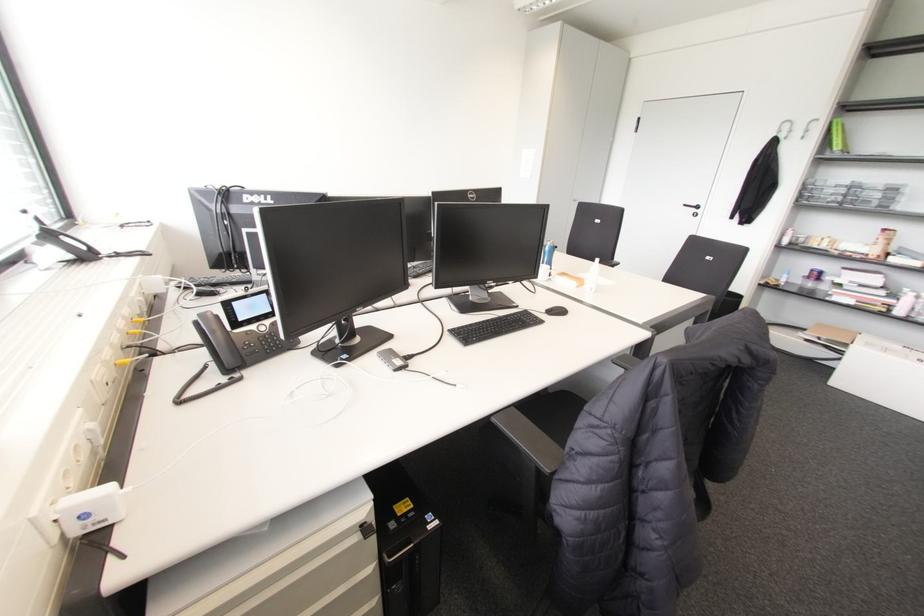
The height and width of the screenshot is (616, 924). Find the location of `black keyboard`. black keyboard is located at coordinates (493, 326).